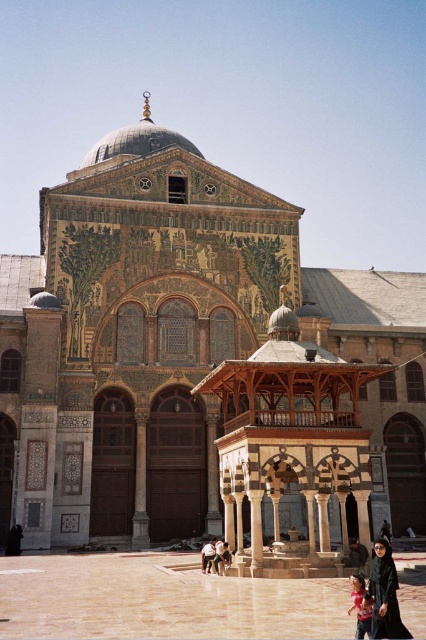
Between mosaic tile church at center and dark brown leather jacket at center, which one has less height?

With less height is dark brown leather jacket at center.

Is mosaic tile church at center bigger than dark brown leather jacket at center?

Correct, mosaic tile church at center is larger in size than dark brown leather jacket at center.

Locate an element on the screen. mosaic tile church at center is located at coordinates (175, 344).

Find the location of a particular element. Image resolution: width=426 pixels, height=640 pixels. mosaic tile church at center is located at coordinates (175, 344).

Does black fabric person at lower right have a lesser height compared to light brown wooden bench at center?

No, black fabric person at lower right is not shorter than light brown wooden bench at center.

Does black fabric person at lower right lie behind light brown wooden bench at center?

That is False.

Between point (374, 561) and point (221, 548), which one is positioned in front?

Point (374, 561) is more forward.

Where is `black fabric person at lower right`? The image size is (426, 640). black fabric person at lower right is located at coordinates (385, 595).

Measure the distance from wooden pavilion at center to light brown leather jacket at lower center.

wooden pavilion at center and light brown leather jacket at lower center are 27.92 feet apart.

Does wooden pavilion at center come behind light brown leather jacket at lower center?

No.

Between point (307, 525) and point (213, 547), which one is positioned behind?

The point (307, 525) is behind.

Find the location of a particular element. The height and width of the screenshot is (640, 426). wooden pavilion at center is located at coordinates (290, 436).